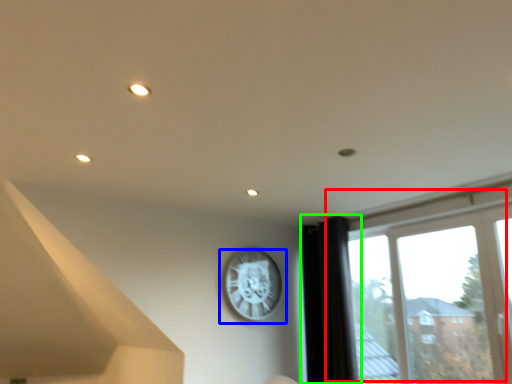
Question: Estimate the real-world distances between objects in this image. Which object is farther from window (highlighted by a red box), wall clock (highlighted by a blue box) or curtain (highlighted by a green box)?

Choices:
 (A) wall clock
 (B) curtain

Answer: (A)